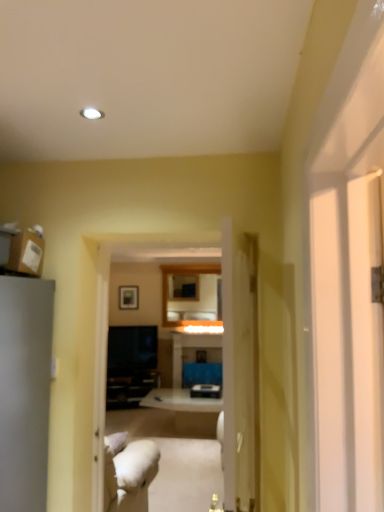
What is the approximate width of black glossy entertainment center at center?

The width of black glossy entertainment center at center is 5.56 centimeters.

Measure the distance between point (123, 329) and camera.

Point (123, 329) is 24.59 feet away from camera.

This screenshot has width=384, height=512. I want to click on black glossy entertainment center at center, so click(x=131, y=365).

The image size is (384, 512). What do you see at coordinates (131, 365) in the screenshot?
I see `black glossy entertainment center at center` at bounding box center [131, 365].

Identify the location of black glossy entertainment center at center. This screenshot has height=512, width=384. (131, 365).